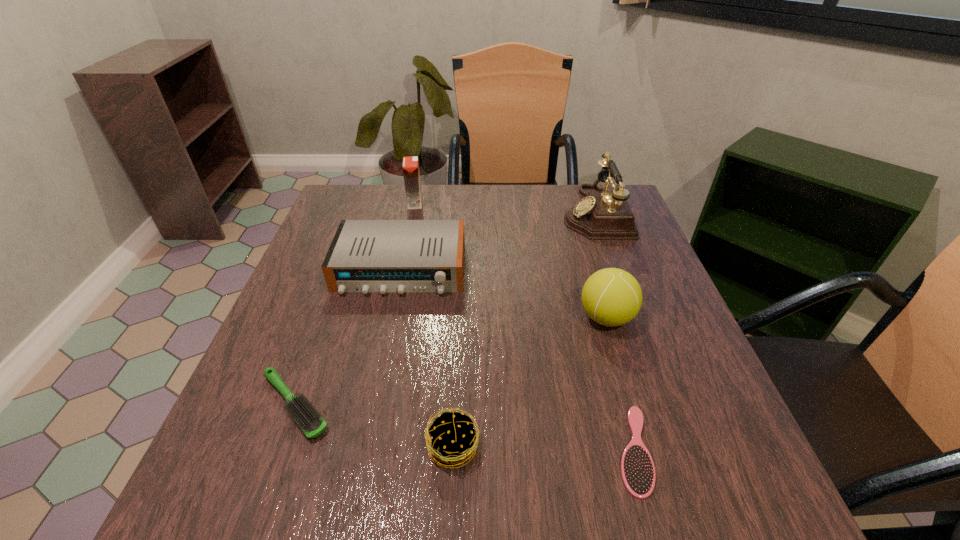
The height and width of the screenshot is (540, 960). I want to click on patty situated at the near edge, so click(459, 443).

Identify the location of hairbrush present at the near edge. (638, 473).

Identify the location of radio receiver that is at the left edge. The image size is (960, 540). (365, 256).

Find the location of a particular element. hairbrush located at the left edge is located at coordinates (307, 417).

The image size is (960, 540). Identify the location of telephone that is at the right edge. (601, 215).

You are a GUI agent. You are given a task and a screenshot of the screen. Output one action in this format:
    pyautogui.click(x=<x>, y=<y>)
    Task: Click on the tennis ball that is at the right edge
    
    Given the screenshot: What is the action you would take?
    pyautogui.click(x=612, y=297)

What are the coordinates of `hairbrush located at the right edge` in the screenshot? It's located at (638, 473).

Locate an element on the screen. The height and width of the screenshot is (540, 960). object that is at the far right corner is located at coordinates (601, 215).

Where is `object that is at the near right corner`? This screenshot has width=960, height=540. object that is at the near right corner is located at coordinates (638, 473).

Find the location of a particular element. Image resolution: width=960 pixels, height=540 pixels. blank area at the far edge is located at coordinates (510, 205).